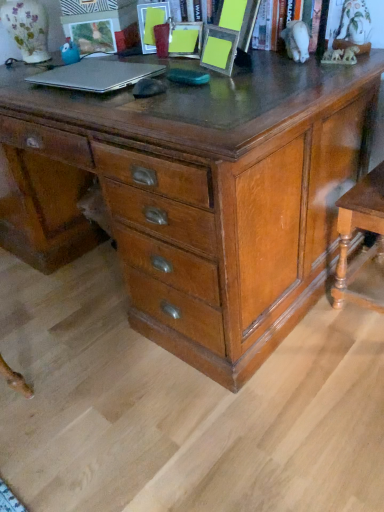
Question: From the image's perspective, is matte plastic picture frame at upper center, the 2th picture frame when ordered from left to right, above or below shiny brown wooden chest of drawers at center?

Choices:
 (A) above
 (B) below

Answer: (A)

Question: Is matte plastic picture frame at upper center, which is the second picture frame in right-to-left order, wider or thinner than shiny brown wooden chest of drawers at center?

Choices:
 (A) wide
 (B) thin

Answer: (B)

Question: Which object is positioned farthest from the shiny brown wooden chest of drawers at center?

Choices:
 (A) matte plastic picture frame at upper left, which is the first picture frame from left to right
 (B) matte plastic picture frame at upper center, the 2th picture frame when ordered from left to right
 (C) matte plastic picture frame at upper center, the 3th picture frame positioned from the left
 (D) silver metallic laptop at upper left
 (E) wooden table at lower right

Answer: (A)

Question: Considering the real-world distances, which object is farthest from the shiny brown wooden chest of drawers at center?

Choices:
 (A) yellow paper at upper center
 (B) matte plastic picture frame at upper left, which is the first picture frame from left to right
 (C) matte plastic picture frame at upper center, the 3th picture frame positioned from the left
 (D) wooden table at lower right
 (E) matte plastic picture frame at upper center, the 2th picture frame when ordered from left to right

Answer: (B)